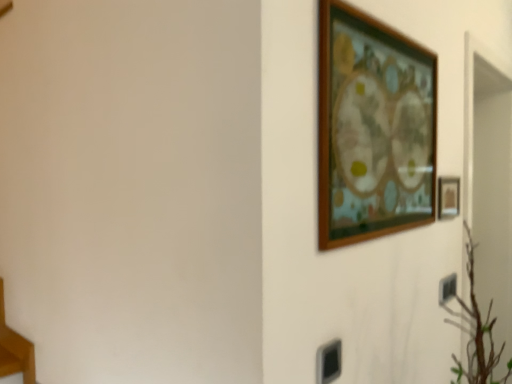
Question: Can you confirm if wooden picture frame at right, placed as the 1th picture frame when sorted from back to front, is wider than wooden table at lower left?

Choices:
 (A) no
 (B) yes

Answer: (A)

Question: Is wooden picture frame at right, placed as the 1th picture frame when sorted from back to front, positioned beyond the bounds of wooden table at lower left?

Choices:
 (A) no
 (B) yes

Answer: (B)

Question: From a real-world perspective, is wooden picture frame at right, marked as the second picture frame in a front-to-back arrangement, positioned under wooden table at lower left based on gravity?

Choices:
 (A) yes
 (B) no

Answer: (B)

Question: Considering the relative sizes of wooden picture frame at right, which ranks as the 1th picture frame in right-to-left order, and wooden table at lower left in the image provided, is wooden picture frame at right, which ranks as the 1th picture frame in right-to-left order, shorter than wooden table at lower left?

Choices:
 (A) yes
 (B) no

Answer: (A)

Question: Can you confirm if wooden picture frame at right, marked as the second picture frame in a front-to-back arrangement, is taller than wooden table at lower left?

Choices:
 (A) yes
 (B) no

Answer: (B)

Question: From their relative heights in the image, would you say wooden picture frame at right, marked as the second picture frame in a left-to-right arrangement, is taller or shorter than wooden table at lower left?

Choices:
 (A) short
 (B) tall

Answer: (A)

Question: Is point (455, 215) positioned closer to the camera than point (16, 344)?

Choices:
 (A) farther
 (B) closer

Answer: (A)

Question: From a real-world perspective, is wooden picture frame at right, marked as the second picture frame in a left-to-right arrangement, positioned above or below wooden table at lower left?

Choices:
 (A) above
 (B) below

Answer: (A)

Question: Is wooden picture frame at right, which ranks as the 1th picture frame in right-to-left order, inside or outside of wooden table at lower left?

Choices:
 (A) inside
 (B) outside

Answer: (B)

Question: From a real-world perspective, is wooden picture frame at upper right, the first picture frame when ordered from left to right, physically located above or below black plastic electric outlet at lower right?

Choices:
 (A) below
 (B) above

Answer: (B)

Question: Based on their positions, is wooden picture frame at upper right, which is the second picture frame from back to front, located to the left or right of black plastic electric outlet at lower right?

Choices:
 (A) right
 (B) left

Answer: (B)

Question: In terms of width, does wooden picture frame at upper right, the first picture frame when ordered from left to right, look wider or thinner when compared to black plastic electric outlet at lower right?

Choices:
 (A) wide
 (B) thin

Answer: (A)

Question: Is wooden picture frame at upper right, arranged as the second picture frame when viewed from the right, inside the boundaries of black plastic electric outlet at lower right, or outside?

Choices:
 (A) outside
 (B) inside

Answer: (A)

Question: From a real-world perspective, is wooden table at lower left above or below black plastic electric outlet at lower right?

Choices:
 (A) above
 (B) below

Answer: (B)

Question: Visually, is wooden table at lower left positioned to the left or to the right of black plastic electric outlet at lower right?

Choices:
 (A) left
 (B) right

Answer: (A)